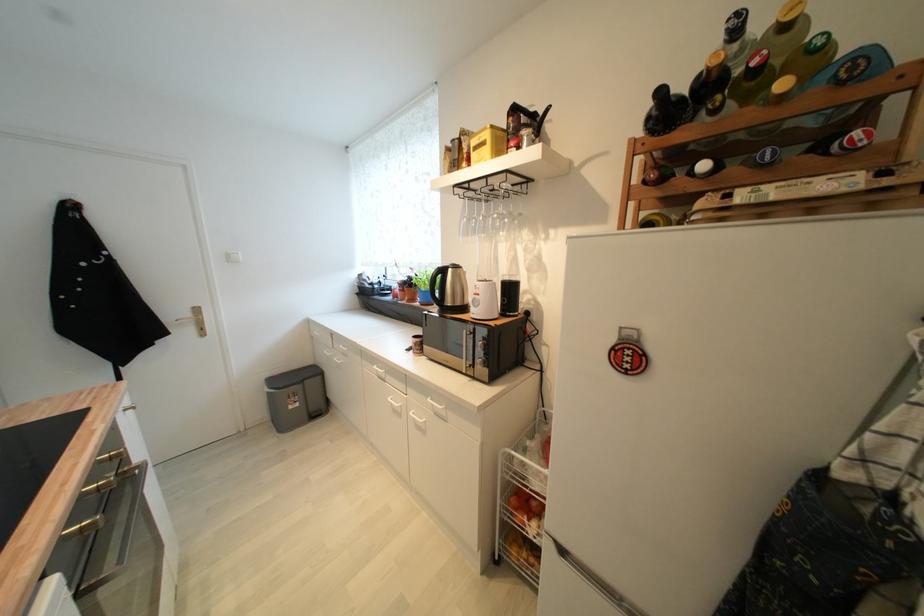
Where would you press the microwave button? Please return your answer as a coordinate pair (x, y).

(499, 355)